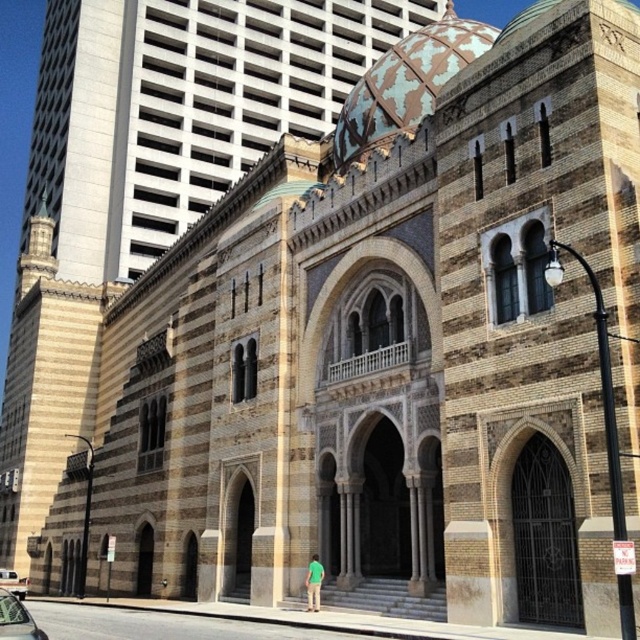
Question: Is metallic silver car at lower left below silver metallic car at lower left?

Choices:
 (A) no
 (B) yes

Answer: (A)

Question: Which point is farther to the camera?

Choices:
 (A) (16, 637)
 (B) (22, 595)

Answer: (B)

Question: Which point is closer to the camera?

Choices:
 (A) metallic silver car at lower left
 (B) silver metallic car at lower left

Answer: (A)

Question: Can you confirm if metallic silver car at lower left is positioned above silver metallic car at lower left?

Choices:
 (A) yes
 (B) no

Answer: (A)

Question: Which point is farther to the camera?

Choices:
 (A) (29, 624)
 (B) (10, 580)

Answer: (B)

Question: Can you confirm if metallic silver car at lower left is positioned to the left of silver metallic car at lower left?

Choices:
 (A) yes
 (B) no

Answer: (B)